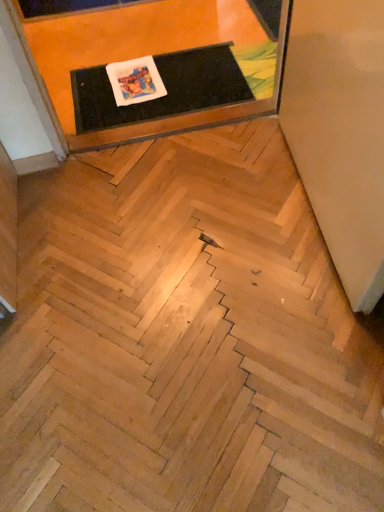
Question: In terms of size, does matte black mat at upper center appear bigger or smaller than black rubber mat at upper center?

Choices:
 (A) big
 (B) small

Answer: (A)

Question: Is matte black mat at upper center wider or thinner than black rubber mat at upper center?

Choices:
 (A) wide
 (B) thin

Answer: (A)

Question: Relative to black rubber mat at upper center, is matte black mat at upper center in front or behind?

Choices:
 (A) front
 (B) behind

Answer: (A)

Question: Visually, is black rubber mat at upper center positioned to the left or to the right of matte black mat at upper center?

Choices:
 (A) right
 (B) left

Answer: (A)

Question: Considering the positions of black rubber mat at upper center and matte black mat at upper center in the image, is black rubber mat at upper center taller or shorter than matte black mat at upper center?

Choices:
 (A) short
 (B) tall

Answer: (A)

Question: Considering the positions of point (x=178, y=102) and point (x=139, y=135), is point (x=178, y=102) closer or farther from the camera than point (x=139, y=135)?

Choices:
 (A) closer
 (B) farther

Answer: (B)

Question: Considering their positions, is black rubber mat at upper center located in front of or behind matte black mat at upper center?

Choices:
 (A) front
 (B) behind

Answer: (B)